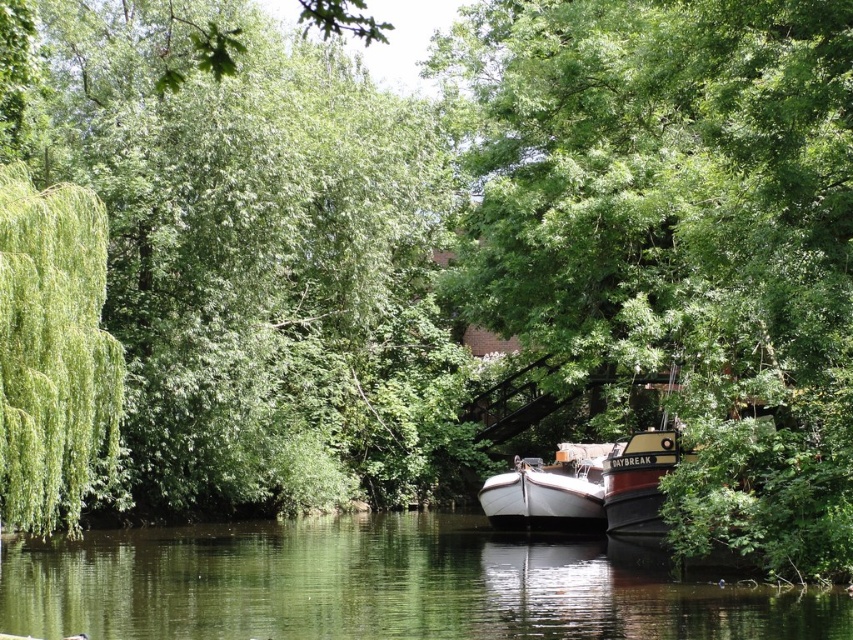
You are standing at the riverside and see two points marked in the image. Which point is closer to you, point (376,556) or point (581,483)?

Point (376,556) is closer to the viewer than point (581,483).

You are standing at the riverside and want to take a photo of the green smooth water at center. According to the coordinates provided, where should you aim your camera?

The green smooth water at center is located at coordinates point (379, 586), so aim your camera there.